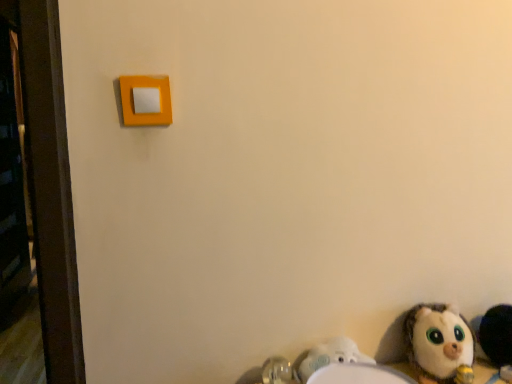
What is the approximate height of white plastic sink at lower right?

It is 9.85 centimeters.

How much space does white plush toy at lower right, which is counted as the 1th toy, starting from the left, occupy horizontally?

6.69 inches.

What do you see at coordinates (497, 335) in the screenshot?
I see `fluffy white stuffed animal at lower right, placed as the second toy when sorted from left to right` at bounding box center [497, 335].

The width and height of the screenshot is (512, 384). I want to click on matte orange light switch at upper left, so click(x=145, y=100).

Visually, is white plastic sink at lower right positioned to the left or to the right of fluffy white stuffed animal at lower right, placed as the second toy when sorted from left to right?

From the image, it's evident that white plastic sink at lower right is to the left of fluffy white stuffed animal at lower right, placed as the second toy when sorted from left to right.

Does white plastic sink at lower right have a greater height compared to fluffy white stuffed animal at lower right, placed as the second toy when sorted from left to right?

No.

What are the coordinates of `the 2nd toy above the white plastic sink at lower right (from the image's perspective)` in the screenshot? It's located at (497, 335).

Is point (298, 370) farther from viewer compared to point (480, 339)?

No, (298, 370) is closer to viewer.

Is there a large distance between fluffy white stuffed animal at lower right, the 1th toy viewed from the right, and white plush toy at lower right, arranged as the second toy when viewed from the right?

No, fluffy white stuffed animal at lower right, the 1th toy viewed from the right, is not far from white plush toy at lower right, arranged as the second toy when viewed from the right.

From the picture: Considering the sizes of fluffy white stuffed animal at lower right, the 1th toy viewed from the right, and white plush toy at lower right, which is counted as the 1th toy, starting from the left, in the image, is fluffy white stuffed animal at lower right, the 1th toy viewed from the right, taller or shorter than white plush toy at lower right, which is counted as the 1th toy, starting from the left,?

fluffy white stuffed animal at lower right, the 1th toy viewed from the right, is taller than white plush toy at lower right, which is counted as the 1th toy, starting from the left.

Does white plush toy at lower right, arranged as the second toy when viewed from the right, have a smaller size compared to white plastic sink at lower right?

No, white plush toy at lower right, arranged as the second toy when viewed from the right, is not smaller than white plastic sink at lower right.

Between white plush toy at lower right, arranged as the second toy when viewed from the right, and white plastic sink at lower right, which one is positioned in front?

white plastic sink at lower right.

Which of these two, matte orange light switch at upper left or white plush toy at lower right, which is counted as the 1th toy, starting from the left, is smaller?

Smaller between the two is matte orange light switch at upper left.

At what (x,y) coordinates should I click in order to perform the action: click on light switch in front of the white plush toy at lower right, arranged as the second toy when viewed from the right. Please return your answer as a coordinate pair (x, y). The image size is (512, 384). Looking at the image, I should click on (145, 100).

Do you think matte orange light switch at upper left is within white plush toy at lower right, which is counted as the 1th toy, starting from the left, or outside of it?

matte orange light switch at upper left exists outside the volume of white plush toy at lower right, which is counted as the 1th toy, starting from the left.

Does matte orange light switch at upper left come behind white plush toy at lower right, arranged as the second toy when viewed from the right?

No, matte orange light switch at upper left is closer to the camera.

Is white plastic sink at lower right far away from white plush toy at lower right, arranged as the second toy when viewed from the right?

No, white plastic sink at lower right is not far away from white plush toy at lower right, arranged as the second toy when viewed from the right.

Which is more to the right, white plastic sink at lower right or white plush toy at lower right, which is counted as the 1th toy, starting from the left?

Positioned to the right is white plush toy at lower right, which is counted as the 1th toy, starting from the left.

Does white plastic sink at lower right have a greater width compared to white plush toy at lower right, arranged as the second toy when viewed from the right?

No, white plastic sink at lower right is not wider than white plush toy at lower right, arranged as the second toy when viewed from the right.

What's the angular difference between white plastic sink at lower right and white plush toy at lower right, arranged as the second toy when viewed from the right,'s facing directions?

white plastic sink at lower right and white plush toy at lower right, arranged as the second toy when viewed from the right, are facing 0.00333 degrees away from each other.

Is matte orange light switch at upper left placed right next to white plastic sink at lower right?

matte orange light switch at upper left and white plastic sink at lower right are clearly separated.

Can you confirm if matte orange light switch at upper left is wider than white plastic sink at lower right?

No, matte orange light switch at upper left is not wider than white plastic sink at lower right.

The height and width of the screenshot is (384, 512). Find the location of `light switch that is above the white plastic sink at lower right (from a real-world perspective)`. light switch that is above the white plastic sink at lower right (from a real-world perspective) is located at coordinates (145, 100).

Which is in front, point (489, 353) or point (359, 361)?

The point (359, 361) is in front.

Which is more to the right, fluffy white stuffed animal at lower right, placed as the second toy when sorted from left to right, or white plastic sink at lower right?

Positioned to the right is fluffy white stuffed animal at lower right, placed as the second toy when sorted from left to right.

Looking at this image, from the image's perspective, which is above, fluffy white stuffed animal at lower right, placed as the second toy when sorted from left to right, or white plastic sink at lower right?

fluffy white stuffed animal at lower right, placed as the second toy when sorted from left to right.

Locate an element on the screen. This screenshot has height=384, width=512. the 2nd toy counting from the right side of the white plastic sink at lower right is located at coordinates (497, 335).

At what (x,y) coordinates should I click in order to perform the action: click on toy that appears below the fluffy white stuffed animal at lower right, placed as the second toy when sorted from left to right (from the image's perspective). Please return your answer as a coordinate pair (x, y). Image resolution: width=512 pixels, height=384 pixels. Looking at the image, I should click on (438, 342).

Looking at the image, which one is located further to matte orange light switch at upper left, white plush toy at lower right, which is counted as the 1th toy, starting from the left, or fluffy white stuffed animal at lower right, the 1th toy viewed from the right?

fluffy white stuffed animal at lower right, the 1th toy viewed from the right.

From the image, which object appears to be farther from white plush toy at lower right, which is counted as the 1th toy, starting from the left, fluffy white stuffed animal at lower right, the 1th toy viewed from the right, or white plastic sink at lower right?

white plastic sink at lower right is further to white plush toy at lower right, which is counted as the 1th toy, starting from the left.

Based on their spatial positions, is fluffy white stuffed animal at lower right, placed as the second toy when sorted from left to right, or matte orange light switch at upper left closer to white plastic sink at lower right?

fluffy white stuffed animal at lower right, placed as the second toy when sorted from left to right, lies closer to white plastic sink at lower right than the other object.

Considering their positions, is fluffy white stuffed animal at lower right, placed as the second toy when sorted from left to right, positioned closer to matte orange light switch at upper left than white plastic sink at lower right?

white plastic sink at lower right.

When comparing their distances from white plush toy at lower right, which is counted as the 1th toy, starting from the left, does matte orange light switch at upper left or white plastic sink at lower right seem closer?

white plastic sink at lower right.

From the image, which object appears to be farther from fluffy white stuffed animal at lower right, the 1th toy viewed from the right, white plush toy at lower right, which is counted as the 1th toy, starting from the left, or matte orange light switch at upper left?

matte orange light switch at upper left lies further to fluffy white stuffed animal at lower right, the 1th toy viewed from the right, than the other object.

Estimate the real-world distances between objects in this image. Which object is closer to white plush toy at lower right, which is counted as the 1th toy, starting from the left, white plastic sink at lower right or fluffy white stuffed animal at lower right, the 1th toy viewed from the right?

The object closer to white plush toy at lower right, which is counted as the 1th toy, starting from the left, is fluffy white stuffed animal at lower right, the 1th toy viewed from the right.

Which object lies nearer to the anchor point fluffy white stuffed animal at lower right, the 1th toy viewed from the right, white plush toy at lower right, which is counted as the 1th toy, starting from the left, or white plastic sink at lower right?

white plush toy at lower right, which is counted as the 1th toy, starting from the left, is closer to fluffy white stuffed animal at lower right, the 1th toy viewed from the right.

I want to click on toy situated between matte orange light switch at upper left and fluffy white stuffed animal at lower right, placed as the second toy when sorted from left to right, from left to right, so click(438, 342).

Locate an element on the screen. This screenshot has width=512, height=384. sink between matte orange light switch at upper left and white plush toy at lower right, which is counted as the 1th toy, starting from the left is located at coordinates (306, 363).

Identify the location of toy between white plastic sink at lower right and fluffy white stuffed animal at lower right, the 1th toy viewed from the right, from left to right. This screenshot has width=512, height=384. (438, 342).

Find the location of a particular element. Image resolution: width=512 pixels, height=384 pixels. sink between matte orange light switch at upper left and fluffy white stuffed animal at lower right, the 1th toy viewed from the right, from left to right is located at coordinates 306,363.